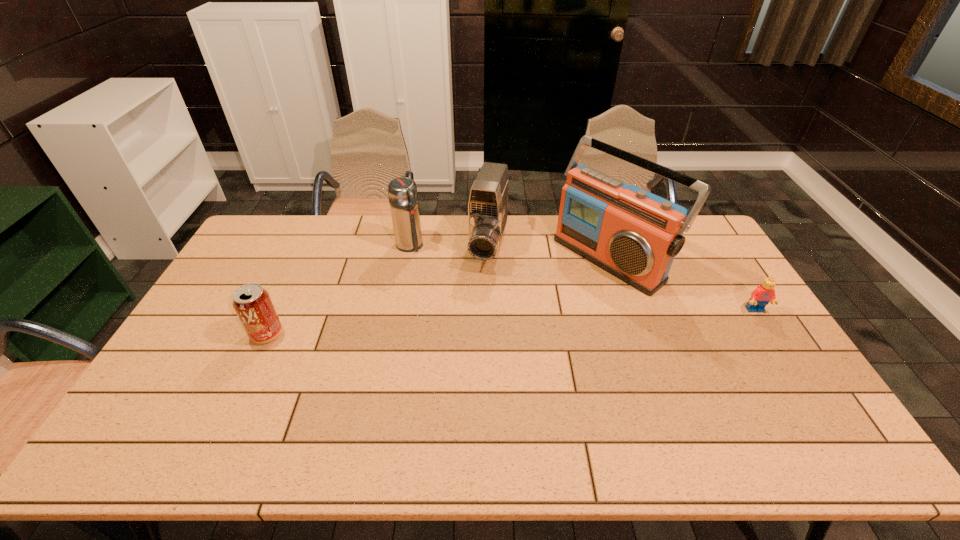
The image size is (960, 540). I want to click on camcorder located in the far edge section of the desktop, so click(488, 202).

The height and width of the screenshot is (540, 960). I want to click on radio receiver that is at the far edge, so click(x=633, y=234).

The height and width of the screenshot is (540, 960). In order to click on object at the right edge in this screenshot , I will do `click(763, 294)`.

The height and width of the screenshot is (540, 960). In the image, there is a desktop. What are the coordinates of `vacant area at the far edge` in the screenshot? It's located at (460, 227).

Locate an element on the screen. vacant area at the near edge of the desktop is located at coordinates (372, 392).

Where is `vacant space at the far left corner of the desktop`? This screenshot has width=960, height=540. vacant space at the far left corner of the desktop is located at coordinates (293, 218).

Find the location of `unoccupied area between the rightmost object and the radio receiver`. unoccupied area between the rightmost object and the radio receiver is located at coordinates (683, 284).

At what (x,y) coordinates should I click in order to perform the action: click on free space between the thermos bottle and the fourth farthest object. Please return your answer as a coordinate pair (x, y). The image size is (960, 540). Looking at the image, I should click on (583, 278).

Identify the location of empty space between the radio receiver and the third object from left to right. The width and height of the screenshot is (960, 540). (550, 252).

Image resolution: width=960 pixels, height=540 pixels. In order to click on empty space between the leftmost object and the fourth farthest object in this screenshot , I will do `click(511, 322)`.